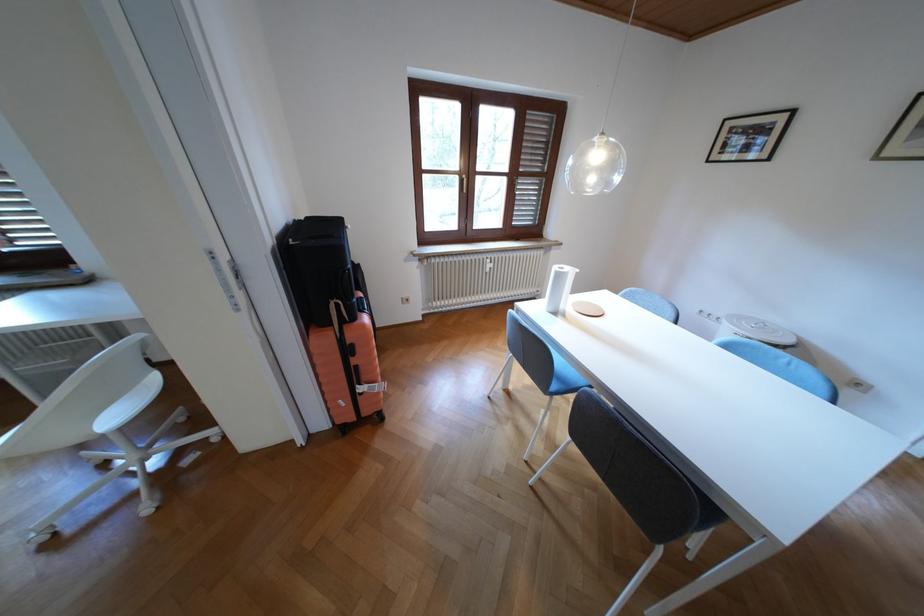
This screenshot has width=924, height=616. What are the coordinates of `brown window handle` in the screenshot? It's located at (465, 182).